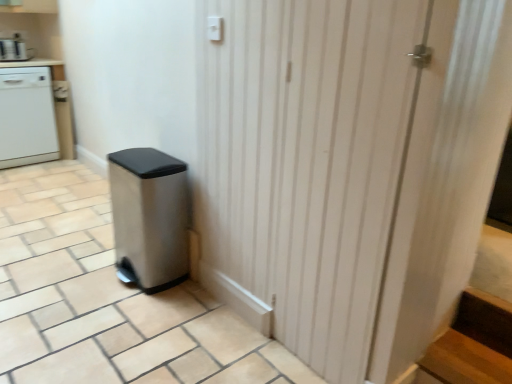
Question: Is stainless steel trash can at lower left facing away from brushed metal coffee maker at upper left?

Choices:
 (A) no
 (B) yes

Answer: (A)

Question: Is stainless steel trash can at lower left touching brushed metal coffee maker at upper left?

Choices:
 (A) yes
 (B) no

Answer: (B)

Question: Is stainless steel trash can at lower left oriented towards brushed metal coffee maker at upper left?

Choices:
 (A) no
 (B) yes

Answer: (A)

Question: Is stainless steel trash can at lower left far away from brushed metal coffee maker at upper left?

Choices:
 (A) no
 (B) yes

Answer: (B)

Question: From a real-world perspective, is stainless steel trash can at lower left located higher than brushed metal coffee maker at upper left?

Choices:
 (A) yes
 (B) no

Answer: (B)

Question: Looking at their shapes, would you say white wood screen door at center is wider or thinner than brushed metal coffee maker at upper left?

Choices:
 (A) thin
 (B) wide

Answer: (A)

Question: Is point (221, 44) positioned closer to the camera than point (25, 46)?

Choices:
 (A) closer
 (B) farther

Answer: (A)

Question: Would you say white wood screen door at center is to the left or to the right of brushed metal coffee maker at upper left in the picture?

Choices:
 (A) right
 (B) left

Answer: (A)

Question: Looking at the image, does white wood screen door at center seem bigger or smaller compared to brushed metal coffee maker at upper left?

Choices:
 (A) big
 (B) small

Answer: (A)

Question: Is point (42, 236) positioned closer to the camera than point (34, 155)?

Choices:
 (A) closer
 (B) farther

Answer: (A)

Question: From the image's perspective, is satin silver trash can at lower left located above or below white glossy dishwasher at left?

Choices:
 (A) above
 (B) below

Answer: (B)

Question: Is satin silver trash can at lower left inside the boundaries of white glossy dishwasher at left, or outside?

Choices:
 (A) inside
 (B) outside

Answer: (B)

Question: Considering the relative positions of satin silver trash can at lower left and white glossy dishwasher at left in the image provided, is satin silver trash can at lower left to the left or to the right of white glossy dishwasher at left?

Choices:
 (A) left
 (B) right

Answer: (B)

Question: Relative to white wood screen door at center, is satin silver trash can at lower left in front or behind?

Choices:
 (A) front
 (B) behind

Answer: (A)

Question: From a real-world perspective, is satin silver trash can at lower left physically located above or below white wood screen door at center?

Choices:
 (A) below
 (B) above

Answer: (A)